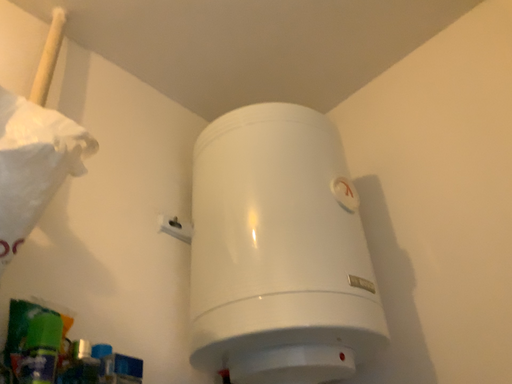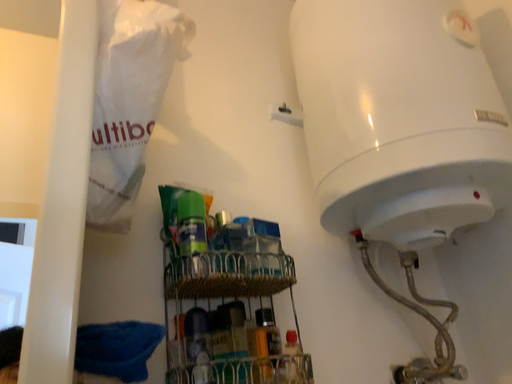
Question: Which way did the camera rotate in the video?

Choices:
 (A) rotated right
 (B) rotated left

Answer: (B)